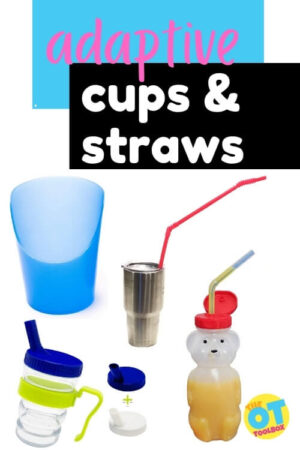
Find the location of `plastic cups`. plastic cups is located at coordinates (130, 422), (46, 429).